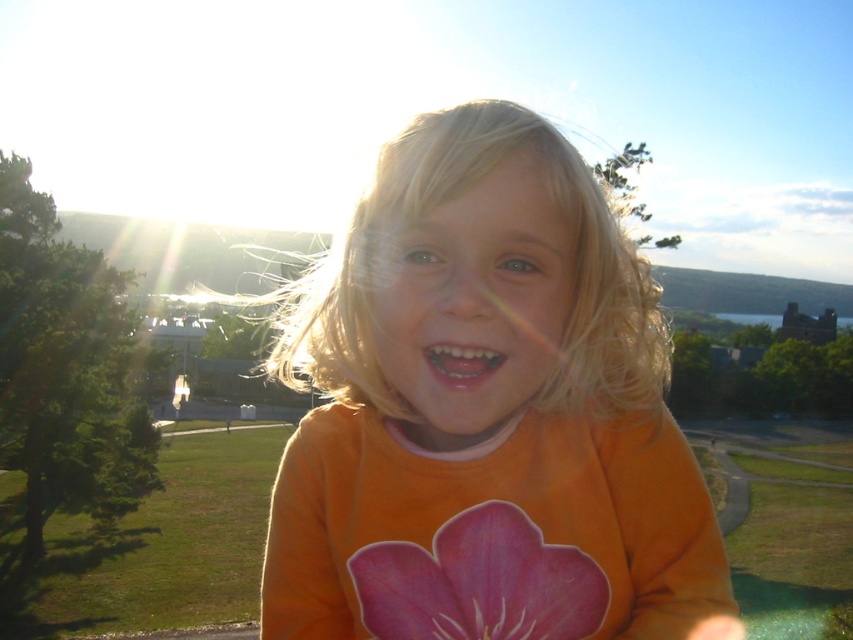
In the scene shown: Is orange matte shirt at center smaller than pink paper flower at center?

No, orange matte shirt at center is not smaller than pink paper flower at center.

Can you confirm if orange matte shirt at center is shorter than pink paper flower at center?

In fact, orange matte shirt at center may be taller than pink paper flower at center.

Where is `orange matte shirt at center`? orange matte shirt at center is located at coordinates (486, 412).

Find the location of a particular element. orange matte shirt at center is located at coordinates (486, 412).